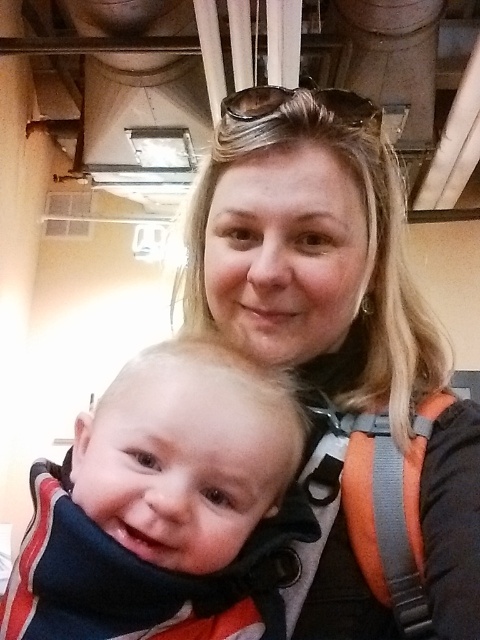
Question: In this image, where is blonde hair at center located relative to soft white scarf at center?

Choices:
 (A) above
 (B) below

Answer: (A)

Question: Is blonde hair at center positioned before soft white scarf at center?

Choices:
 (A) yes
 (B) no

Answer: (B)

Question: Among these objects, which one is nearest to the camera?

Choices:
 (A) soft white scarf at center
 (B) blonde hair at center

Answer: (A)

Question: Among these points, which one is nearest to the camera?

Choices:
 (A) (211, 204)
 (B) (108, 557)

Answer: (B)

Question: Does blonde hair at center come behind soft white scarf at center?

Choices:
 (A) no
 (B) yes

Answer: (B)

Question: Which object appears farthest from the camera in this image?

Choices:
 (A) blonde hair at center
 (B) soft white scarf at center

Answer: (A)